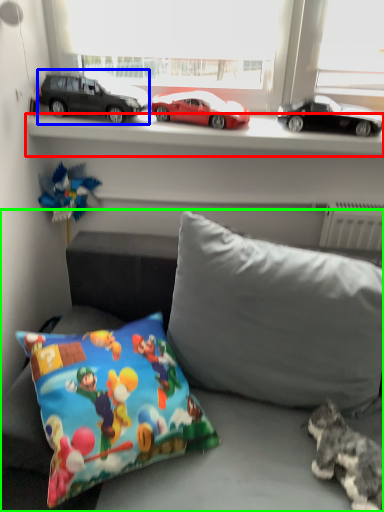
Question: Based on their relative distances, which object is farther from window sill (highlighted by a red box)? Choose from car (highlighted by a blue box) and studio couch (highlighted by a green box).

Choices:
 (A) car
 (B) studio couch

Answer: (B)